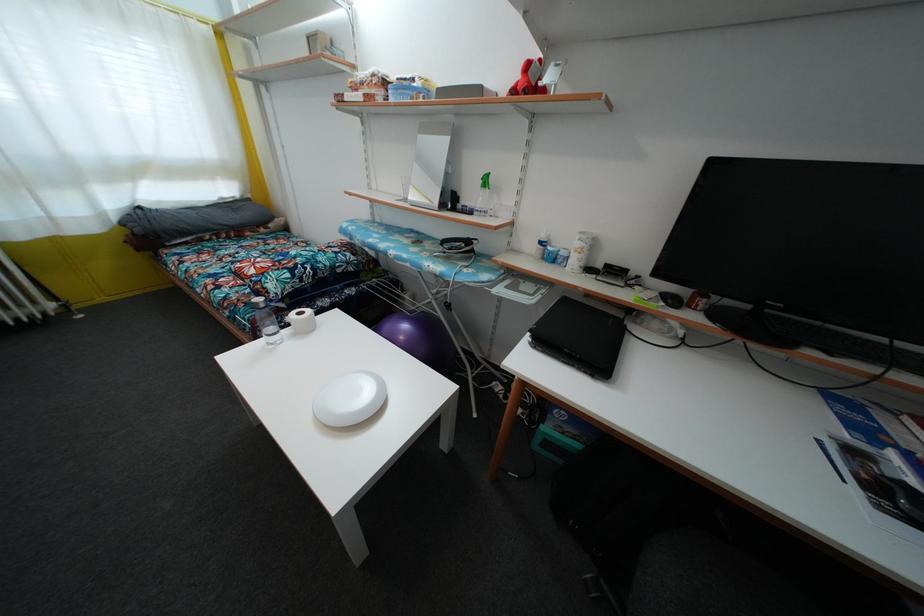
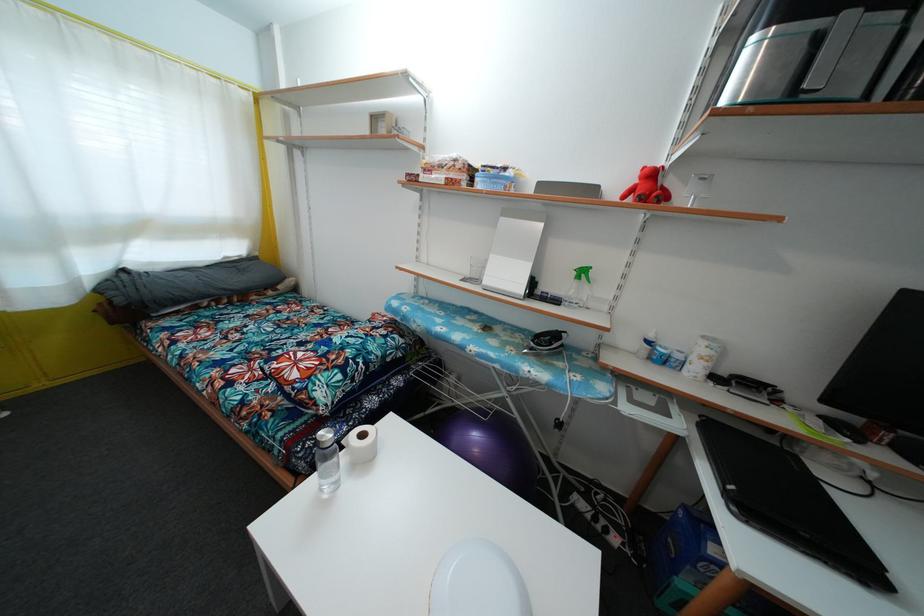
Which direction would the cameraman need to move to produce the second image?

The movement direction of the cameraman is left, forward.